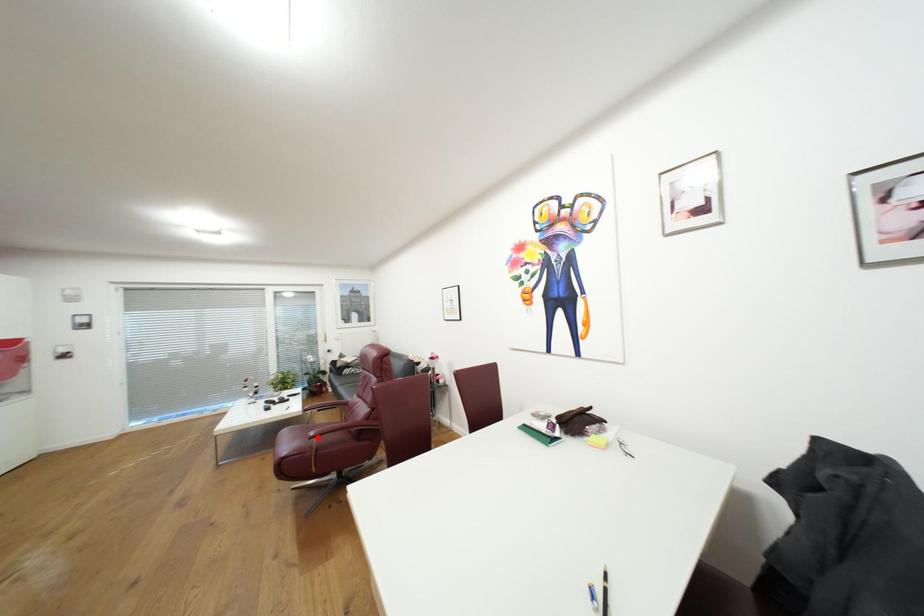
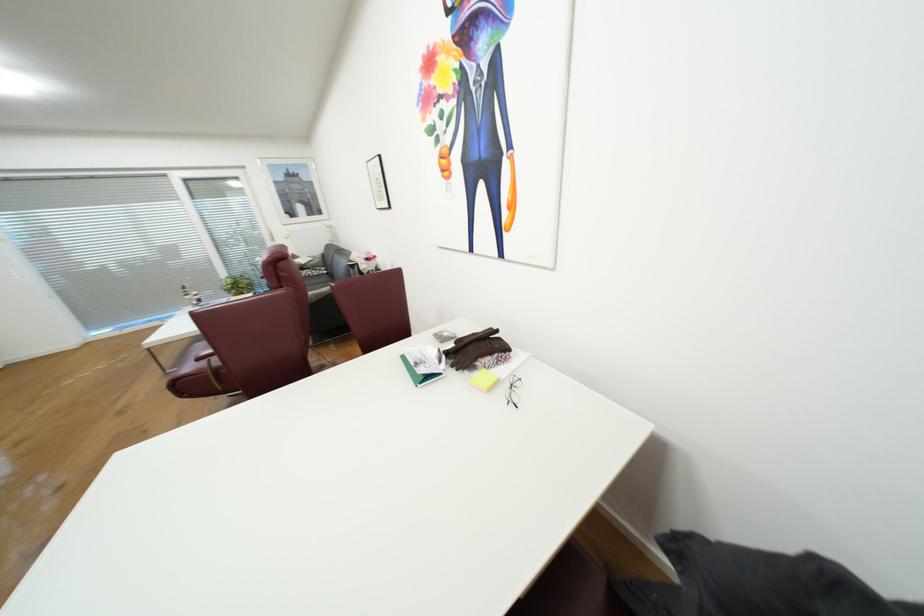
Find the pixel in the second image that matches the highlighted location in the first image.

(205, 360)